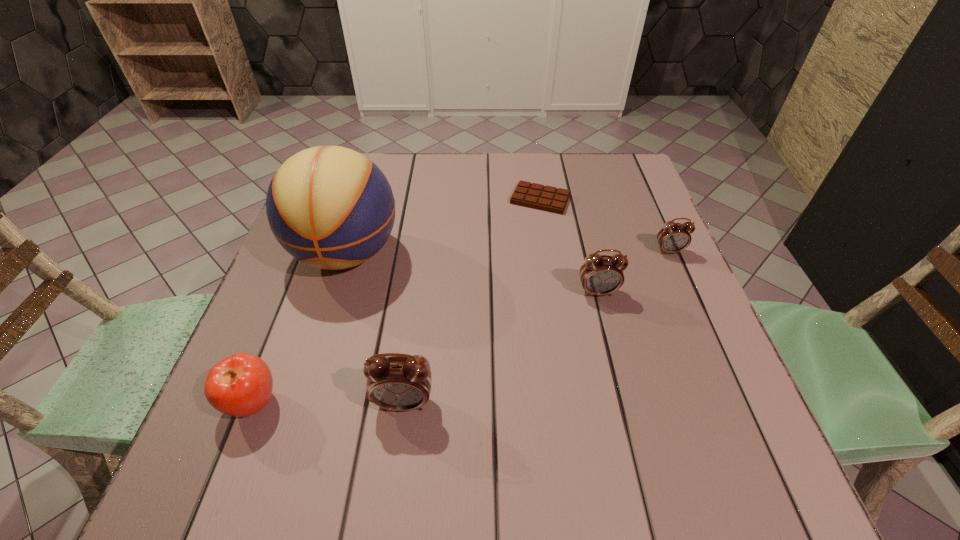
Locate which alarm clock ranks in proximity to the rightmost alarm clock. Please provide its 2D coordinates. Your answer should be formatted as a tuple, i.e. [(x, y)], where the tuple contains the x and y coordinates of a point satisfying the conditions above.

[(600, 275)]